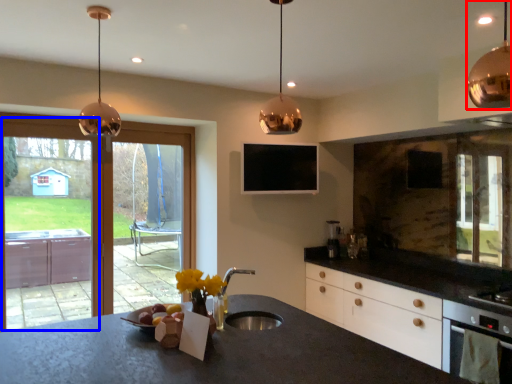
Question: Which point is further to the camera, lamp (highlighted by a red box) or screen door (highlighted by a blue box)?

Choices:
 (A) lamp
 (B) screen door

Answer: (B)